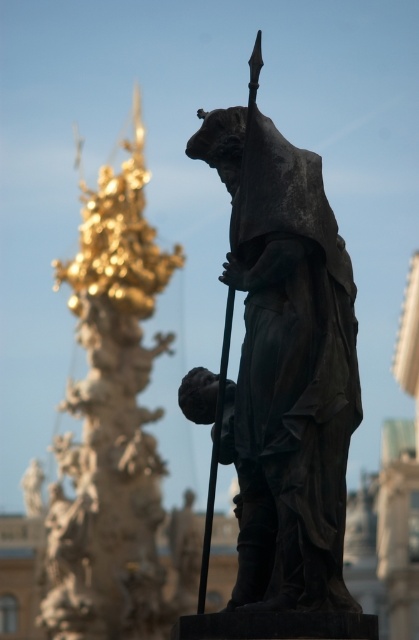
Question: Does bronze statue at center appear on the left side of gold polished column at left?

Choices:
 (A) yes
 (B) no

Answer: (B)

Question: Which point is closer to the camera taking this photo?

Choices:
 (A) (170, 264)
 (B) (196, 157)

Answer: (B)

Question: Does bronze statue at center have a larger size compared to gold polished column at left?

Choices:
 (A) yes
 (B) no

Answer: (B)

Question: Which of the following is the farthest from the observer?

Choices:
 (A) gold polished column at left
 (B) bronze statue at center

Answer: (A)

Question: Can you confirm if bronze statue at center is wider than gold polished column at left?

Choices:
 (A) no
 (B) yes

Answer: (A)